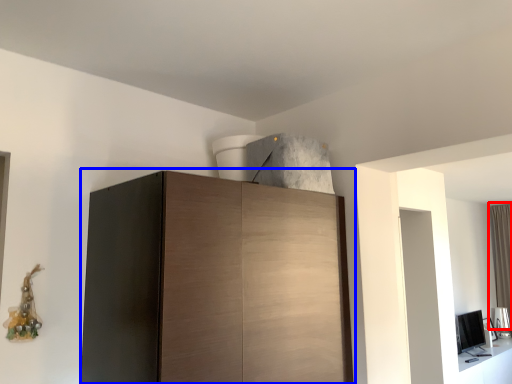
Question: Which point is closer to the camera, curtain (highlighted by a red box) or cupboard (highlighted by a blue box)?

Choices:
 (A) curtain
 (B) cupboard

Answer: (B)